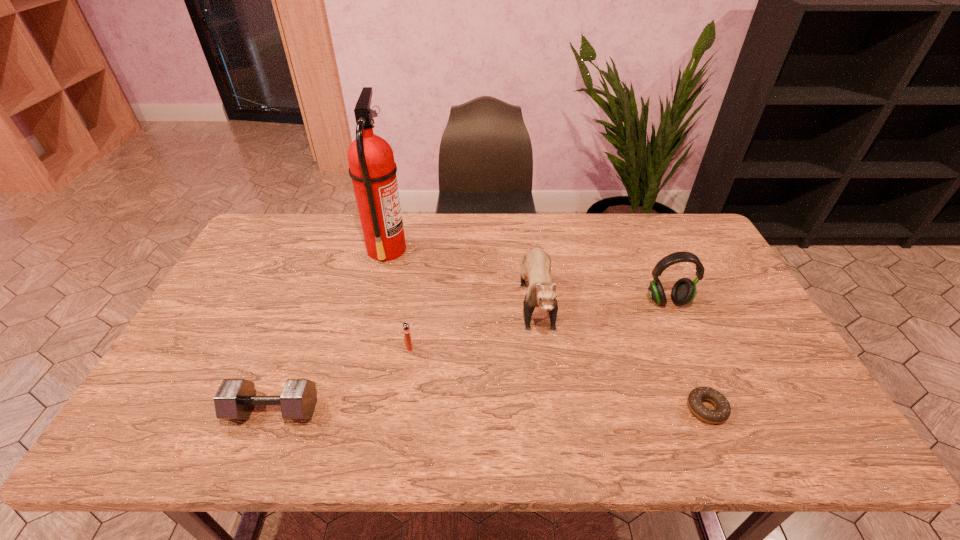
Locate an element on the screen. fire extinguisher is located at coordinates (372, 168).

You are a GUI agent. You are given a task and a screenshot of the screen. Output one action in this format:
    pyautogui.click(x=<x>, y=<y>)
    Task: Click on the second object from left to right
    The width and height of the screenshot is (960, 540).
    Given the screenshot: What is the action you would take?
    pyautogui.click(x=372, y=168)

I want to click on ferret, so click(536, 265).

Locate an element on the screen. The height and width of the screenshot is (540, 960). headset is located at coordinates (683, 292).

At what (x,y) coordinates should I click in order to perform the action: click on the leftmost object. Please return your answer as a coordinate pair (x, y). This screenshot has height=540, width=960. Looking at the image, I should click on (235, 399).

In order to click on the third object from left to right in this screenshot , I will do `click(406, 328)`.

At what (x,y) coordinates should I click in order to perform the action: click on doughnut. Please return your answer as a coordinate pair (x, y). Looking at the image, I should click on pyautogui.click(x=722, y=412).

Where is `free space located on the side of the fifth object from right to left near the handle`? free space located on the side of the fifth object from right to left near the handle is located at coordinates (431, 249).

Where is `vacant space located 0.230m on the face of the fourth object from left to right`? The height and width of the screenshot is (540, 960). vacant space located 0.230m on the face of the fourth object from left to right is located at coordinates (554, 427).

Identify the location of vacant space located on the ear cups of the headset. The image size is (960, 540). (684, 338).